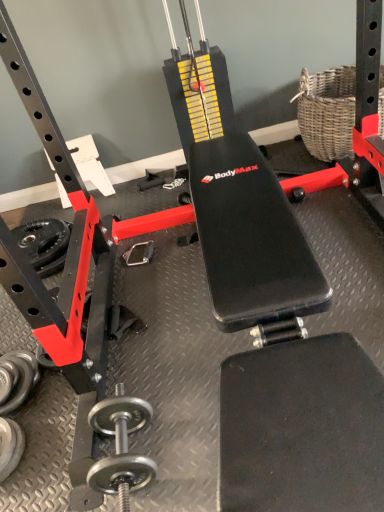
I want to click on free space that is in between silver metallic dumbbell at lower left, marked as the first dumbbell in a left-to-right arrangement, and polished silver dumbbell at lower left, which ranks as the third dumbbell in left-to-right order, so click(x=57, y=431).